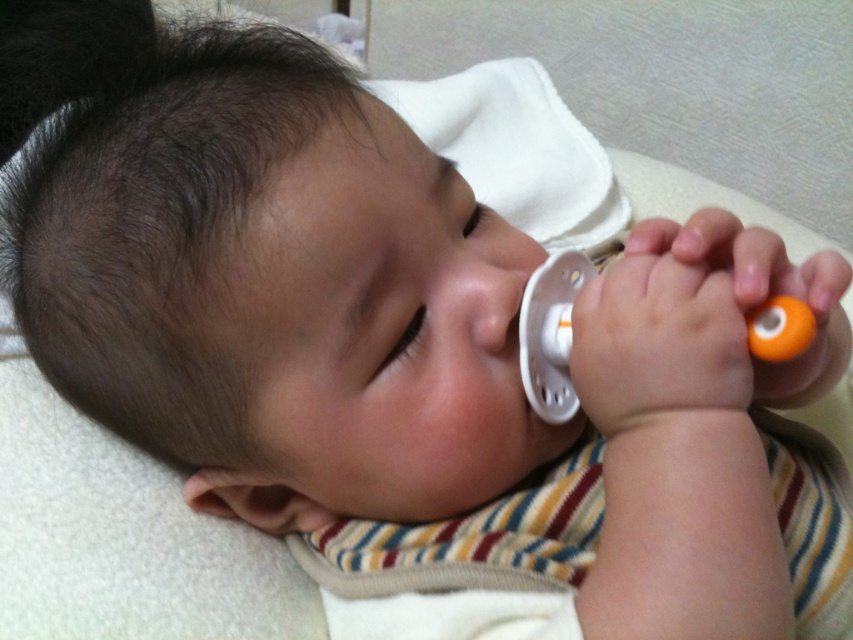
Question: Can you confirm if white plastic pacifier at right is bigger than white plastic pacifier at center?

Choices:
 (A) no
 (B) yes

Answer: (B)

Question: Which point is farther from the camera taking this photo?

Choices:
 (A) (541, 371)
 (B) (415, 314)

Answer: (A)

Question: In this image, where is white plastic pacifier at right located relative to white plastic pacifier at center?

Choices:
 (A) right
 (B) left

Answer: (A)

Question: Which of the following is the closest to the observer?

Choices:
 (A) (405, 342)
 (B) (535, 360)

Answer: (A)

Question: Does white plastic pacifier at right have a larger size compared to white plastic pacifier at center?

Choices:
 (A) no
 (B) yes

Answer: (B)